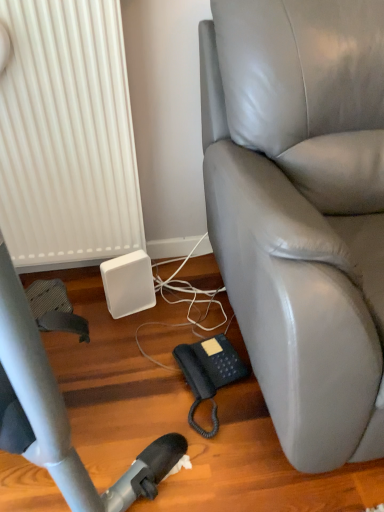
Locate an element on the screen. vacant location below black rubberized phone at lower center (from a real-world perspective) is located at coordinates (213, 403).